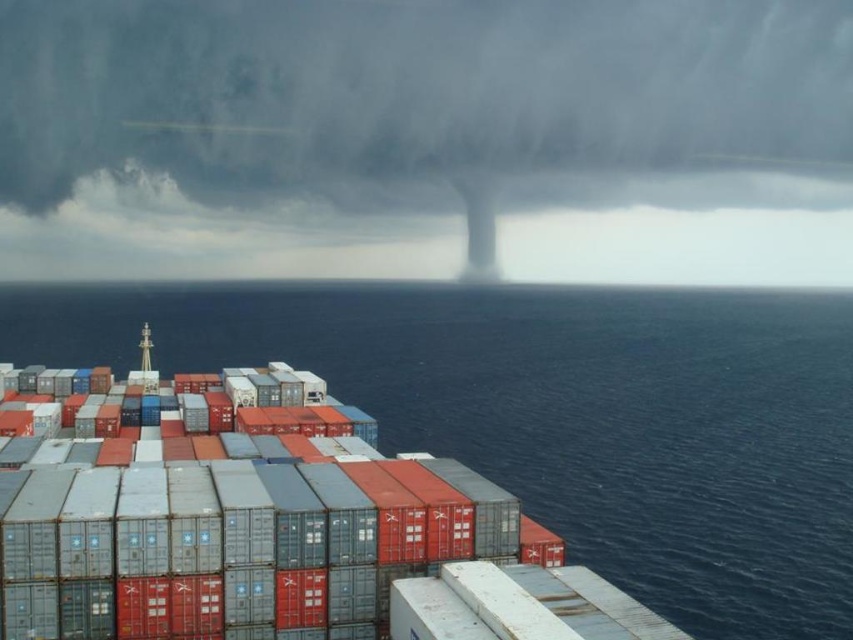
The image size is (853, 640). Describe the element at coordinates (428, 140) in the screenshot. I see `dark gray cloud at upper center` at that location.

Looking at this image, which is more to the left, dark gray cloud at upper center or blue water at lower left?

dark gray cloud at upper center is more to the left.

Does point (685, 13) come in front of point (550, 360)?

No, it is not.

Where is `dark gray cloud at upper center`? This screenshot has width=853, height=640. dark gray cloud at upper center is located at coordinates point(428,140).